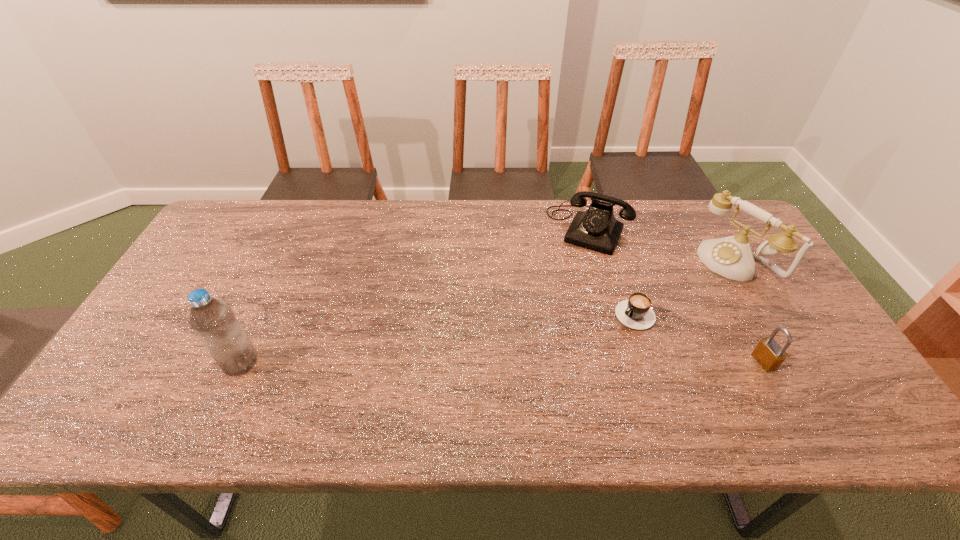
In the image, there is a desktop. What are the coordinates of `free space at the far right corner` in the screenshot? It's located at (704, 216).

You are a GUI agent. You are given a task and a screenshot of the screen. Output one action in this format:
    pyautogui.click(x=<x>, y=<y>)
    Task: Click on the vacant area that lies between the leftmost object and the fourth shortest object
    This screenshot has width=960, height=540.
    Given the screenshot: What is the action you would take?
    pyautogui.click(x=488, y=312)

Where is `free space between the fourth shortest object and the leftmost object`? free space between the fourth shortest object and the leftmost object is located at coordinates (488, 312).

Image resolution: width=960 pixels, height=540 pixels. In order to click on free space between the left telephone and the shortest object in this screenshot , I will do `click(616, 272)`.

The height and width of the screenshot is (540, 960). I want to click on vacant space in between the second tallest object and the third farthest object, so click(x=689, y=288).

Locate an element on the screen. The image size is (960, 540). free space between the leftmost object and the shortest object is located at coordinates (442, 339).

Where is `vacant area that lies between the right telephone and the shortest object`? This screenshot has height=540, width=960. vacant area that lies between the right telephone and the shortest object is located at coordinates (689, 288).

Find the location of a particular element. The width and height of the screenshot is (960, 540). vacant space that is in between the leftmost object and the second tallest object is located at coordinates (488, 312).

At what (x,y) coordinates should I click in order to perform the action: click on free spot between the padlock and the cappuccino. Please return your answer as a coordinate pair (x, y). Image resolution: width=960 pixels, height=540 pixels. Looking at the image, I should click on (704, 339).

Where is `empty location between the water bottle and the shortest object`? This screenshot has width=960, height=540. empty location between the water bottle and the shortest object is located at coordinates (442, 339).